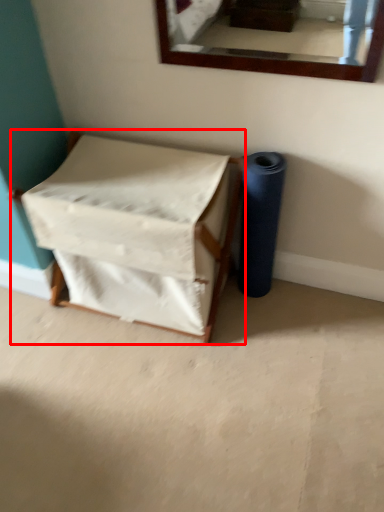
Question: From the image's perspective, where is furniture (annotated by the red box) located relative to toilet paper?

Choices:
 (A) below
 (B) above

Answer: (A)